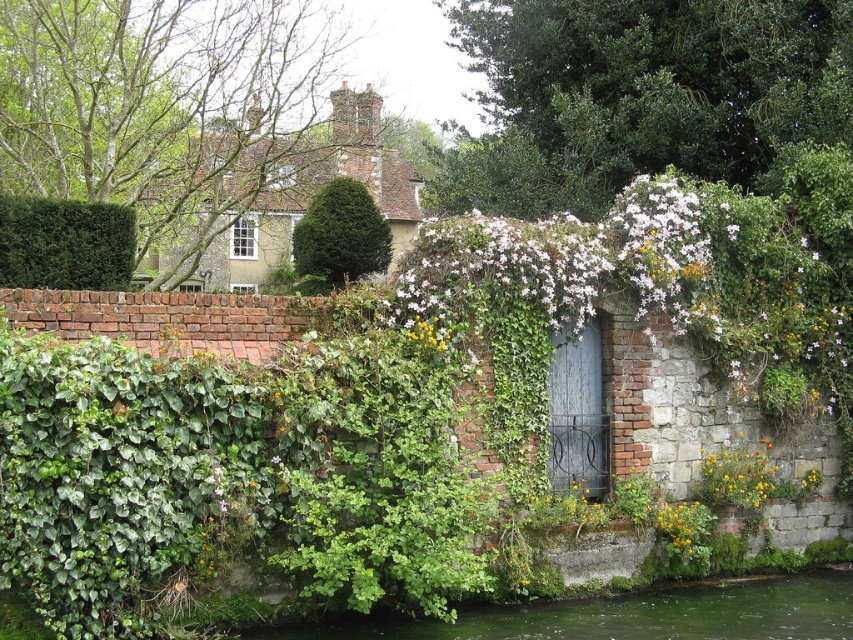
Is point (683, 596) closer to camera compared to point (708, 490)?

That is True.

The image size is (853, 640). What do you see at coordinates (631, 614) in the screenshot?
I see `green mossy stone at lower center` at bounding box center [631, 614].

The width and height of the screenshot is (853, 640). I want to click on green mossy stone at lower center, so click(631, 614).

Who is positioned more to the right, white matte flowers at center or green leafy bush at upper left?

white matte flowers at center is more to the right.

In the scene shown: Is white matte flowers at center taller than green leafy bush at upper left?

Indeed, white matte flowers at center has a greater height compared to green leafy bush at upper left.

What do you see at coordinates (675, 268) in the screenshot? I see `white matte flowers at center` at bounding box center [675, 268].

Where is `white matte flowers at center`? white matte flowers at center is located at coordinates (675, 268).

Can you confirm if white matte flowers at center is bigger than green mossy stone at lower center?

Yes.

Where is `white matte flowers at center`? white matte flowers at center is located at coordinates (675, 268).

Where is `white matte flowers at center`? The image size is (853, 640). white matte flowers at center is located at coordinates (675, 268).